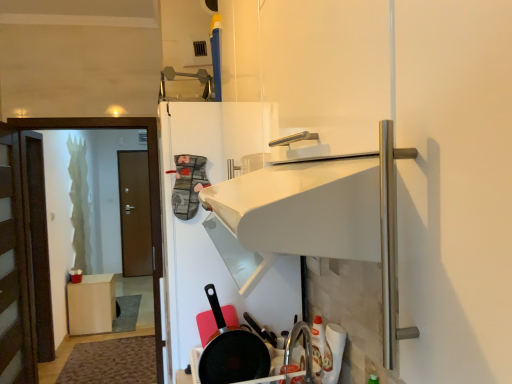
What do you see at coordinates (14, 271) in the screenshot? The height and width of the screenshot is (384, 512). I see `brown wooden door at left, which ranks as the 2th door in back-to-front order` at bounding box center [14, 271].

You are a GUI agent. You are given a task and a screenshot of the screen. Output one action in this format:
    pyautogui.click(x=<x>, y=<y>)
    Task: Click on the matte wood cabinet at lower left
    Image resolution: width=512 pixels, height=384 pixels.
    Given the screenshot: What is the action you would take?
    pyautogui.click(x=91, y=305)

Where is `brown wooden door at left, which ranks as the 2th door in back-to-front order`? The height and width of the screenshot is (384, 512). brown wooden door at left, which ranks as the 2th door in back-to-front order is located at coordinates (14, 271).

Is non-stick black frying pan at lower center taller than brown wooden door at left, the second door when ordered from front to back?

No, non-stick black frying pan at lower center is not taller than brown wooden door at left, the second door when ordered from front to back.

How distant is non-stick black frying pan at lower center from brown wooden door at left, acting as the first door starting from the back?

A distance of 4.98 meters exists between non-stick black frying pan at lower center and brown wooden door at left, acting as the first door starting from the back.

Is non-stick black frying pan at lower center closer to the viewer compared to brown wooden door at left, the second door when ordered from front to back?

Yes, it is.

Does point (76, 302) come behind point (23, 336)?

Yes, point (76, 302) is farther from viewer.

Is matte wood cabinet at lower left facing away from brown wooden door at left, which ranks as the 2th door in back-to-front order?

No, matte wood cabinet at lower left's orientation is not away from brown wooden door at left, which ranks as the 2th door in back-to-front order.

Considering the sizes of matte wood cabinet at lower left and brown wooden door at left, the 1th door in the front-to-back sequence, in the image, is matte wood cabinet at lower left taller or shorter than brown wooden door at left, the 1th door in the front-to-back sequence,?

Clearly, matte wood cabinet at lower left is shorter compared to brown wooden door at left, the 1th door in the front-to-back sequence.

From a real-world perspective, does brown wooden door at left, acting as the first door starting from the back, stand above brown wooden door at left, which ranks as the 2th door in back-to-front order?

Incorrect, from a real-world perspective, brown wooden door at left, acting as the first door starting from the back, is lower than brown wooden door at left, which ranks as the 2th door in back-to-front order.

Does brown wooden door at left, acting as the first door starting from the back, touch brown wooden door at left, which ranks as the 2th door in back-to-front order?

No, brown wooden door at left, acting as the first door starting from the back, is not making contact with brown wooden door at left, which ranks as the 2th door in back-to-front order.

Image resolution: width=512 pixels, height=384 pixels. I want to click on door on the right of brown wooden door at left, the second door when ordered from front to back, so click(x=14, y=271).

Between brown wooden door at left, acting as the first door starting from the back, and brown wooden door at left, which ranks as the 2th door in back-to-front order, which one is positioned in front?

brown wooden door at left, which ranks as the 2th door in back-to-front order.

Is brown wooden door at left, the 1th door in the front-to-back sequence, facing away from non-stick black frying pan at lower center?

That's not correct — brown wooden door at left, the 1th door in the front-to-back sequence, is not looking away from non-stick black frying pan at lower center.

From a real-world perspective, is brown wooden door at left, which ranks as the 2th door in back-to-front order, physically below non-stick black frying pan at lower center?

Yes, from a real-world perspective, brown wooden door at left, which ranks as the 2th door in back-to-front order, is below non-stick black frying pan at lower center.

What are the coordinates of `frying pan on the right of the brown wooden door at left, the 1th door in the front-to-back sequence` in the screenshot? It's located at coord(231,352).

From the image's perspective, is matte wood cabinet at lower left positioned above or below brown wooden door at left, acting as the first door starting from the back?

From the image's perspective, matte wood cabinet at lower left appears below brown wooden door at left, acting as the first door starting from the back.

Is matte wood cabinet at lower left facing away from brown wooden door at left, acting as the first door starting from the back?

No, matte wood cabinet at lower left is not facing the opposite direction of brown wooden door at left, acting as the first door starting from the back.

Can you confirm if matte wood cabinet at lower left is wider than brown wooden door at left, acting as the first door starting from the back?

Indeed, matte wood cabinet at lower left has a greater width compared to brown wooden door at left, acting as the first door starting from the back.

Considering the positions of point (76, 326) and point (132, 222), is point (76, 326) closer or farther from the camera than point (132, 222)?

Point (76, 326) is closer to the camera than point (132, 222).

Is matte brown screen door at left not near matte wood cabinet at lower left?

Indeed, matte brown screen door at left is not near matte wood cabinet at lower left.

Measure the distance from matte brown screen door at left to matte wood cabinet at lower left.

The distance of matte brown screen door at left from matte wood cabinet at lower left is 6.76 feet.

Looking at their sizes, would you say matte brown screen door at left is wider or thinner than matte wood cabinet at lower left?

matte brown screen door at left is thinner than matte wood cabinet at lower left.

From the picture: Between matte brown screen door at left and matte wood cabinet at lower left, which one appears on the right side from the viewer's perspective?

matte brown screen door at left is more to the right.

Is matte brown screen door at left bigger or smaller than non-stick black frying pan at lower center?

Clearly, matte brown screen door at left is larger in size than non-stick black frying pan at lower center.

Is matte brown screen door at left outside of non-stick black frying pan at lower center?

Yes, matte brown screen door at left is outside of non-stick black frying pan at lower center.

From the image's perspective, between matte brown screen door at left and non-stick black frying pan at lower center, who is located below?

non-stick black frying pan at lower center appears lower in the image.

At what (x,y) coordinates should I click in order to perform the action: click on door that is the 2nd one when counting leftward from the non-stick black frying pan at lower center. Please return your answer as a coordinate pair (x, y). This screenshot has width=512, height=384. Looking at the image, I should click on (135, 214).

In order to click on door in front of the matte wood cabinet at lower left in this screenshot , I will do `click(14, 271)`.

From the image, which object appears to be farther from brown wooden door at left, the 1th door in the front-to-back sequence, matte wood cabinet at lower left or brown wooden door at left, the second door when ordered from front to back?

brown wooden door at left, the second door when ordered from front to back, is positioned further to the anchor brown wooden door at left, the 1th door in the front-to-back sequence.

Considering their positions, is matte brown screen door at left positioned closer to brown wooden door at left, acting as the first door starting from the back, than matte wood cabinet at lower left?

matte wood cabinet at lower left is closer to brown wooden door at left, acting as the first door starting from the back.

Estimate the real-world distances between objects in this image. Which object is further from brown wooden door at left, the second door when ordered from front to back, non-stick black frying pan at lower center or brown wooden door at left, which ranks as the 2th door in back-to-front order?

Based on the image, non-stick black frying pan at lower center appears to be further to brown wooden door at left, the second door when ordered from front to back.

Which object lies further to the anchor point matte brown screen door at left, matte wood cabinet at lower left or brown wooden door at left, which ranks as the 2th door in back-to-front order?

matte wood cabinet at lower left lies further to matte brown screen door at left than the other object.

From the picture: Looking at the image, which one is located closer to matte brown screen door at left, non-stick black frying pan at lower center or matte wood cabinet at lower left?

non-stick black frying pan at lower center is positioned closer to the anchor matte brown screen door at left.

Estimate the real-world distances between objects in this image. Which object is further from matte brown screen door at left, brown wooden door at left, the second door when ordered from front to back, or non-stick black frying pan at lower center?

Based on the image, brown wooden door at left, the second door when ordered from front to back, appears to be further to matte brown screen door at left.

Looking at the image, which one is located closer to matte brown screen door at left, brown wooden door at left, which ranks as the 2th door in back-to-front order, or brown wooden door at left, acting as the first door starting from the back?

Based on the image, brown wooden door at left, which ranks as the 2th door in back-to-front order, appears to be nearer to matte brown screen door at left.

Estimate the real-world distances between objects in this image. Which object is further from brown wooden door at left, the second door when ordered from front to back, brown wooden door at left, which ranks as the 2th door in back-to-front order, or matte wood cabinet at lower left?

Based on the image, brown wooden door at left, which ranks as the 2th door in back-to-front order, appears to be further to brown wooden door at left, the second door when ordered from front to back.

Where is `door located between matte brown screen door at left and brown wooden door at left, acting as the first door starting from the back, in the depth direction`? Image resolution: width=512 pixels, height=384 pixels. door located between matte brown screen door at left and brown wooden door at left, acting as the first door starting from the back, in the depth direction is located at coordinates (14, 271).

Where is `furniture located between non-stick black frying pan at lower center and brown wooden door at left, the second door when ordered from front to back, in the depth direction`? This screenshot has width=512, height=384. furniture located between non-stick black frying pan at lower center and brown wooden door at left, the second door when ordered from front to back, in the depth direction is located at coordinates (91, 305).

You are a GUI agent. You are given a task and a screenshot of the screen. Output one action in this format:
    pyautogui.click(x=<x>, y=<y>)
    Task: Click on the screen door between non-stick black frying pan at lower center and brown wooden door at left, acting as the first door starting from the back, along the z-axis
    
    Given the screenshot: What is the action you would take?
    pyautogui.click(x=149, y=187)

Find the location of `furniture between matte brown screen door at left and brown wooden door at left, the second door when ordered from front to back, in the front-back direction`. furniture between matte brown screen door at left and brown wooden door at left, the second door when ordered from front to back, in the front-back direction is located at coordinates (91, 305).